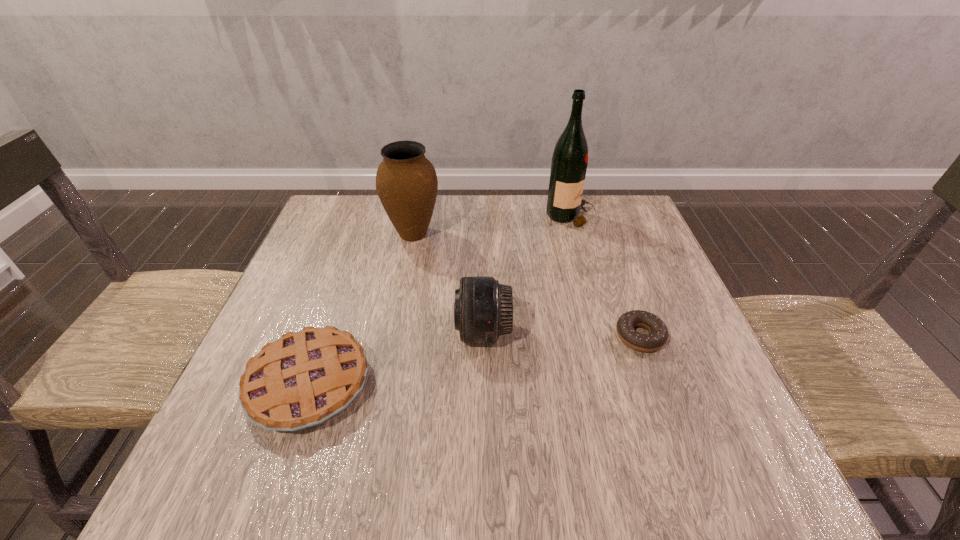
Locate an element on the screen. This screenshot has height=540, width=960. vacant area that lies between the shortest object and the second shortest object is located at coordinates [474, 360].

This screenshot has width=960, height=540. Find the location of `free space that is in between the telephoto lens and the second shortest object`. free space that is in between the telephoto lens and the second shortest object is located at coordinates (396, 358).

Find the location of `vacant region between the wine bottle and the urn`. vacant region between the wine bottle and the urn is located at coordinates (492, 226).

This screenshot has height=540, width=960. What are the coordinates of `free space between the pie and the tallest object` in the screenshot? It's located at (440, 301).

Find the location of a particular element. The width and height of the screenshot is (960, 540). free spot between the tallest object and the urn is located at coordinates (492, 226).

Where is `vacant area between the wine bottle and the second tallest object`? This screenshot has height=540, width=960. vacant area between the wine bottle and the second tallest object is located at coordinates [x=492, y=226].

The image size is (960, 540). What are the coordinates of `free space that is in between the wine bottle and the third object from left to right` in the screenshot? It's located at (527, 275).

Select which object appears as the second closest to the urn. Please provide its 2D coordinates. Your answer should be formatted as a tuple, i.e. [(x, y)], where the tuple contains the x and y coordinates of a point satisfying the conditions above.

[(569, 163)]

Find the location of a particular element. This screenshot has height=540, width=960. object that is the fourth closest to the fourth tallest object is located at coordinates (569, 163).

Where is `free space in the image that satisfies the following two spatial constraints: 1. on the front-facing side of the shortest object; 2. on the left side of the third tallest object`? The image size is (960, 540). free space in the image that satisfies the following two spatial constraints: 1. on the front-facing side of the shortest object; 2. on the left side of the third tallest object is located at coordinates (483, 336).